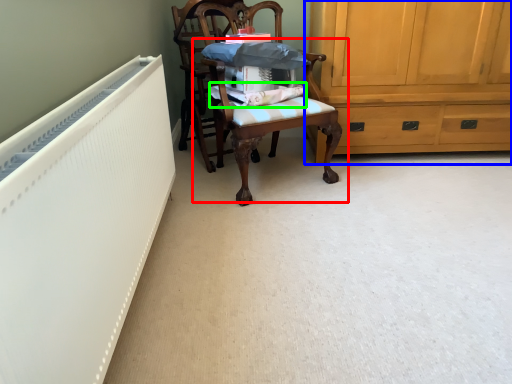
Question: Which object is positioned farthest from chair (highlighted by a red box)? Select from cabinetry (highlighted by a blue box) and fabric (highlighted by a green box).

Choices:
 (A) cabinetry
 (B) fabric

Answer: (A)